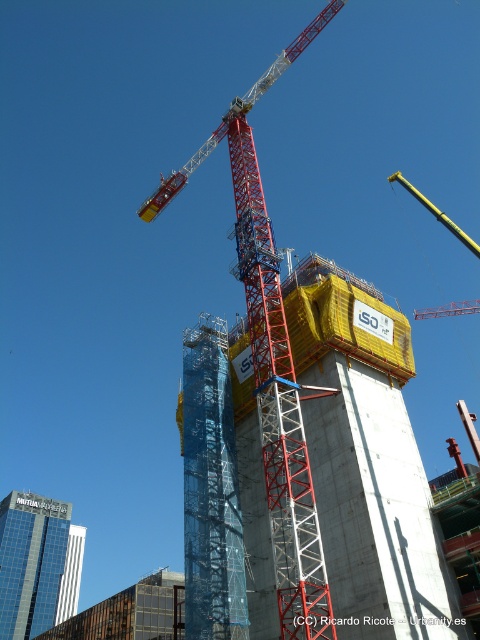
Question: Which object is the farthest from the yellow fabric-covered tower at center?

Choices:
 (A) red metal crane at center
 (B) glass skyscraper at center

Answer: (B)

Question: Which point is closer to the camera?

Choices:
 (A) (56, 532)
 (B) (58, 596)
 (C) (203, 372)
 (D) (336, 490)

Answer: (D)

Question: Is blue mesh scaffolding at center above white glass tower at center?

Choices:
 (A) no
 (B) yes

Answer: (B)

Question: Which of the following is the closest to the observer?

Choices:
 (A) white glass tower at center
 (B) glass skyscraper at center

Answer: (B)

Question: Is glass skyscraper at center further to camera compared to white glass tower at center?

Choices:
 (A) no
 (B) yes

Answer: (A)

Question: Is yellow fabric-covered tower at center closer to camera compared to red metal crane at center?

Choices:
 (A) no
 (B) yes

Answer: (A)